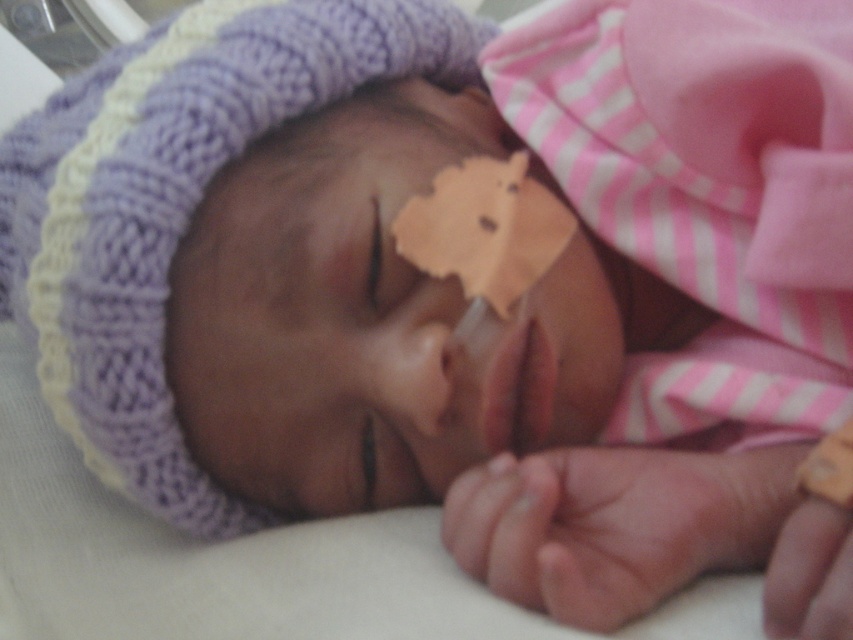
Question: Among these objects, which one is nearest to the camera?

Choices:
 (A) smooth skin nose at center
 (B) pink smooth skin at lower right

Answer: (B)

Question: Can you confirm if pink smooth skin at lower right is wider than smooth skin nose at center?

Choices:
 (A) yes
 (B) no

Answer: (A)

Question: Among these points, which one is nearest to the camera?

Choices:
 (A) (376, 349)
 (B) (637, 525)

Answer: (B)

Question: Is pink smooth skin at lower right below smooth skin nose at center?

Choices:
 (A) no
 (B) yes

Answer: (B)

Question: Does pink smooth skin at lower right lie behind smooth skin nose at center?

Choices:
 (A) yes
 (B) no

Answer: (B)